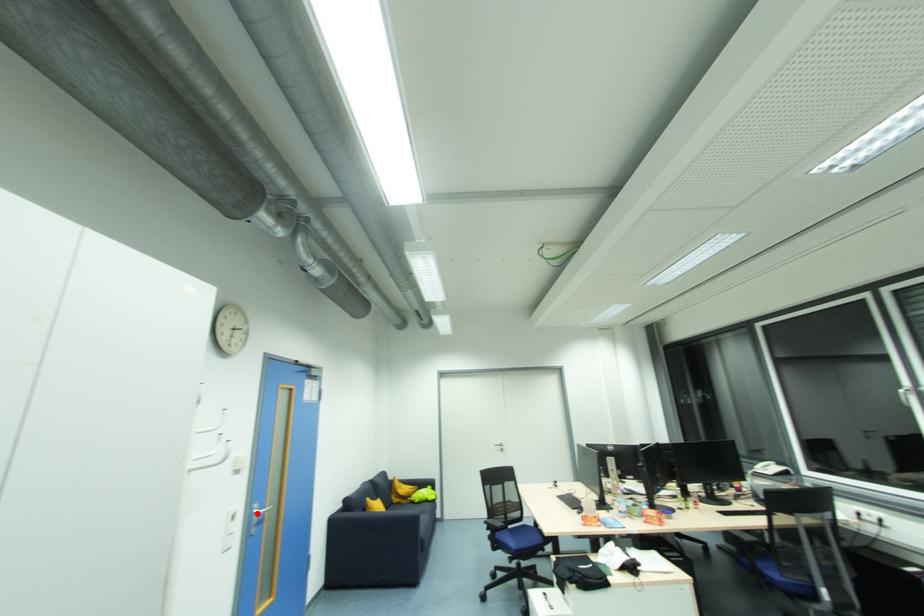
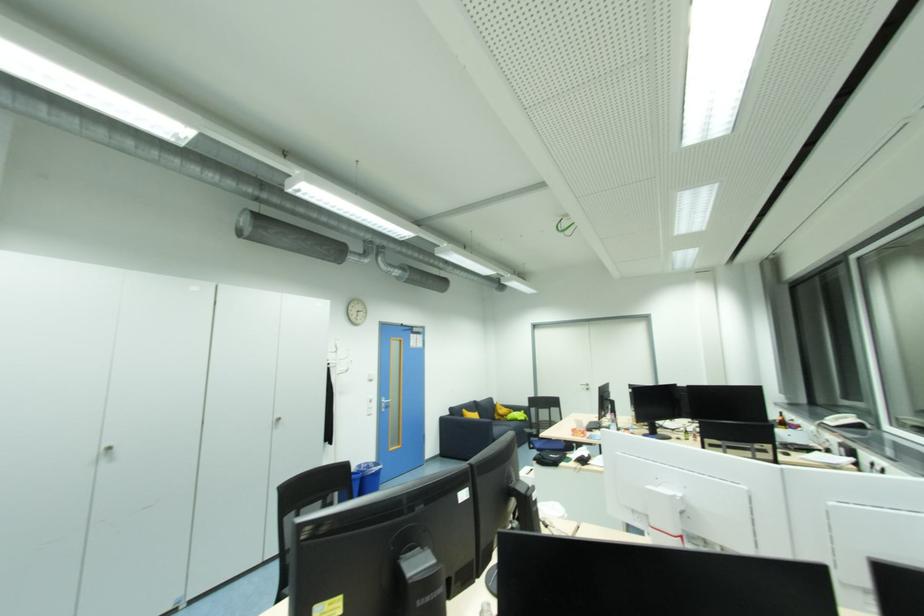
Locate, in the second image, the point that corresponds to the highlighted location in the first image.

(386, 402)